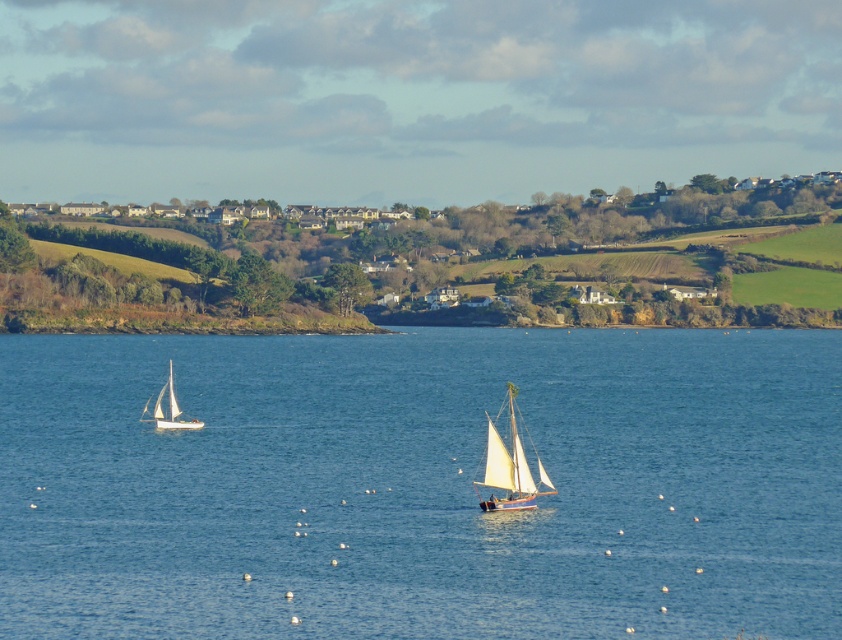
Question: Which of the following is the farthest from the observer?

Choices:
 (A) white matte sailboat at lower left
 (B) wooden sailboat at center
 (C) blue water at center

Answer: (A)

Question: Does wooden sailboat at center come in front of white matte sailboat at lower left?

Choices:
 (A) yes
 (B) no

Answer: (A)

Question: Which object is closer to the camera taking this photo?

Choices:
 (A) wooden sailboat at center
 (B) blue water at center
 (C) white matte sailboat at lower left

Answer: (B)

Question: Which of the following is the closest to the observer?

Choices:
 (A) wooden sailboat at center
 (B) white matte sailboat at lower left
 (C) blue water at center

Answer: (C)

Question: Can you confirm if wooden sailboat at center is positioned to the left of white matte sailboat at lower left?

Choices:
 (A) no
 (B) yes

Answer: (A)

Question: Can you confirm if wooden sailboat at center is thinner than white matte sailboat at lower left?

Choices:
 (A) no
 (B) yes

Answer: (B)